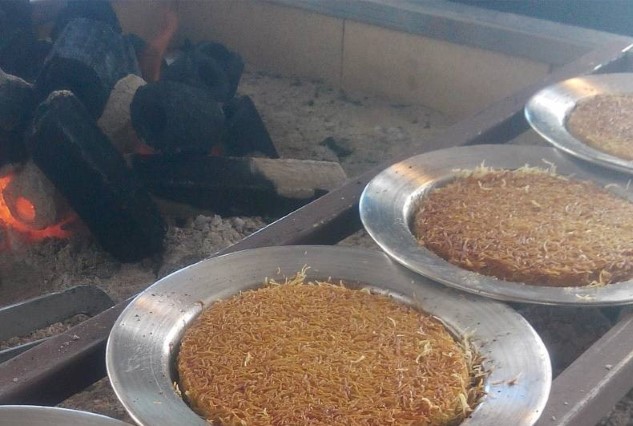
In order to click on outer edge of plate in this screenshot , I will do `click(15, 416)`.